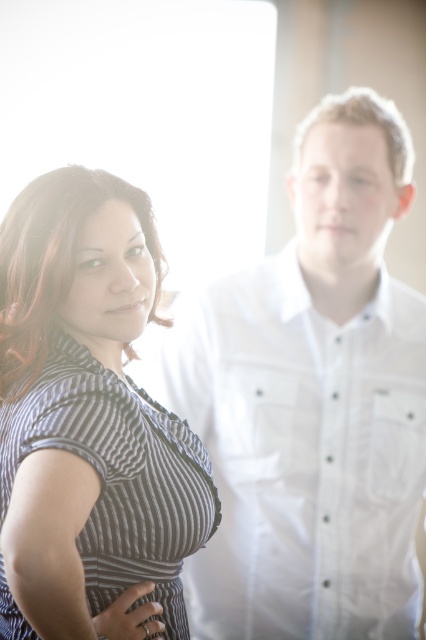
Question: Which of the following is the farthest from the observer?

Choices:
 (A) striped fabric dress at left
 (B) white cotton shirt at left

Answer: (B)

Question: Does white cotton shirt at left have a larger size compared to striped fabric dress at left?

Choices:
 (A) yes
 (B) no

Answer: (B)

Question: Does white cotton shirt at left come behind striped fabric dress at left?

Choices:
 (A) no
 (B) yes

Answer: (B)

Question: Which point appears farthest from the camera in this image?

Choices:
 (A) (72, 166)
 (B) (299, 604)

Answer: (B)

Question: Which of the following is the farthest from the observer?

Choices:
 (A) (184, 518)
 (B) (385, 577)

Answer: (B)

Question: Can you confirm if white cotton shirt at left is smaller than striped fabric dress at left?

Choices:
 (A) yes
 (B) no

Answer: (A)